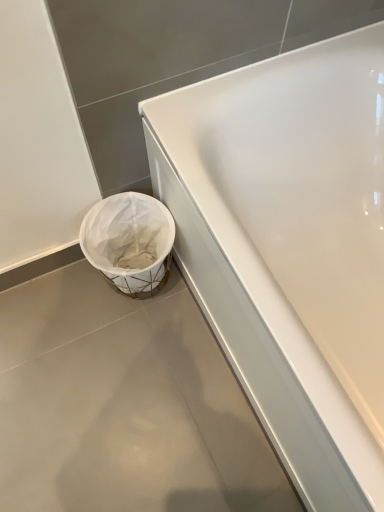
Locate an element on the screen. This screenshot has width=384, height=512. white glossy bathtub at center is located at coordinates (290, 247).

Would you say white glossy bathtub at center is outside white fabric basket at lower left?

Yes.

Considering the relative sizes of white glossy bathtub at center and white fabric basket at lower left in the image provided, is white glossy bathtub at center bigger than white fabric basket at lower left?

Yes.

Is point (335, 292) in front of point (90, 224)?

Yes, point (335, 292) is in front of point (90, 224).

From the picture: Which is in front, white glossy bathtub at center or white fabric basket at lower left?

white glossy bathtub at center is in front.

Which is more to the left, white matte trash can at lower left or white fabric basket at lower left?

white matte trash can at lower left.

Is white matte trash can at lower left smaller than white fabric basket at lower left?

Indeed, white matte trash can at lower left has a smaller size compared to white fabric basket at lower left.

From a real-world perspective, is white matte trash can at lower left on top of white fabric basket at lower left?

Incorrect, from a real-world perspective, white matte trash can at lower left is lower than white fabric basket at lower left.

From the image's perspective, which is above, white fabric basket at lower left or white glossy bathtub at center?

white fabric basket at lower left appears higher in the image.

Is white fabric basket at lower left looking in the opposite direction of white glossy bathtub at center?

Yes.

Looking at this image, is white fabric basket at lower left to the left of white glossy bathtub at center from the viewer's perspective?

Correct, you'll find white fabric basket at lower left to the left of white glossy bathtub at center.

Which of these two, white glossy bathtub at center or white matte trash can at lower left, stands shorter?

white matte trash can at lower left is shorter.

Consider the image. Can you tell me how much white glossy bathtub at center and white matte trash can at lower left differ in facing direction?

white glossy bathtub at center and white matte trash can at lower left are facing 90.5 degrees away from each other.

From a real-world perspective, is white glossy bathtub at center over white matte trash can at lower left?

Yes, from a real-world perspective, white glossy bathtub at center is on top of white matte trash can at lower left.

From the image's perspective, is white glossy bathtub at center located above white matte trash can at lower left?

Yes, from the image's perspective, white glossy bathtub at center is above white matte trash can at lower left.

Is white matte trash can at lower left next to white glossy bathtub at center?

white matte trash can at lower left and white glossy bathtub at center are clearly separated.

In the image, there is a white glossy bathtub at center. Identify the location of concrete below it (from the image's perspective). (123, 404).

From a real-world perspective, is white matte trash can at lower left positioned over white glossy bathtub at center based on gravity?

No, from a real-world perspective, white matte trash can at lower left is not over white glossy bathtub at center

From a real-world perspective, which object rests below the other?

In real-world perspective, white matte trash can at lower left is lower.

What's the angular difference between white fabric basket at lower left and white matte trash can at lower left's facing directions?

90.9 degrees.

Which object is wider, white fabric basket at lower left or white matte trash can at lower left?

Wider between the two is white matte trash can at lower left.

From the picture: Considering the relative sizes of white fabric basket at lower left and white matte trash can at lower left in the image provided, is white fabric basket at lower left taller than white matte trash can at lower left?

Yes.

In order to click on bathtub on the right of white fabric basket at lower left in this screenshot , I will do 290,247.

You are a GUI agent. You are given a task and a screenshot of the screen. Output one action in this format:
    pyautogui.click(x=<x>, y=<y>)
    Task: Click on the waste container above the white matte trash can at lower left (from the image's perspective)
    This screenshot has width=384, height=512.
    Given the screenshot: What is the action you would take?
    pyautogui.click(x=130, y=242)

Based on the photo, from the image, which object appears to be farther from white glossy bathtub at center, white matte trash can at lower left or white fabric basket at lower left?

white matte trash can at lower left is further to white glossy bathtub at center.

From the image, which object appears to be nearer to white glossy bathtub at center, white fabric basket at lower left or white matte trash can at lower left?

white fabric basket at lower left is closer to white glossy bathtub at center.

When comparing their distances from white matte trash can at lower left, does white glossy bathtub at center or white fabric basket at lower left seem closer?

The object closer to white matte trash can at lower left is white fabric basket at lower left.

Which object lies further to the anchor point white fabric basket at lower left, white matte trash can at lower left or white glossy bathtub at center?

white glossy bathtub at center is positioned further to the anchor white fabric basket at lower left.

Looking at the image, which one is located closer to white fabric basket at lower left, white glossy bathtub at center or white matte trash can at lower left?

white matte trash can at lower left is closer to white fabric basket at lower left.

When comparing their distances from white matte trash can at lower left, does white fabric basket at lower left or white glossy bathtub at center seem further?

white glossy bathtub at center is further to white matte trash can at lower left.

What are the coordinates of `waste container between white matte trash can at lower left and white glossy bathtub at center in the horizontal direction` in the screenshot? It's located at (130, 242).